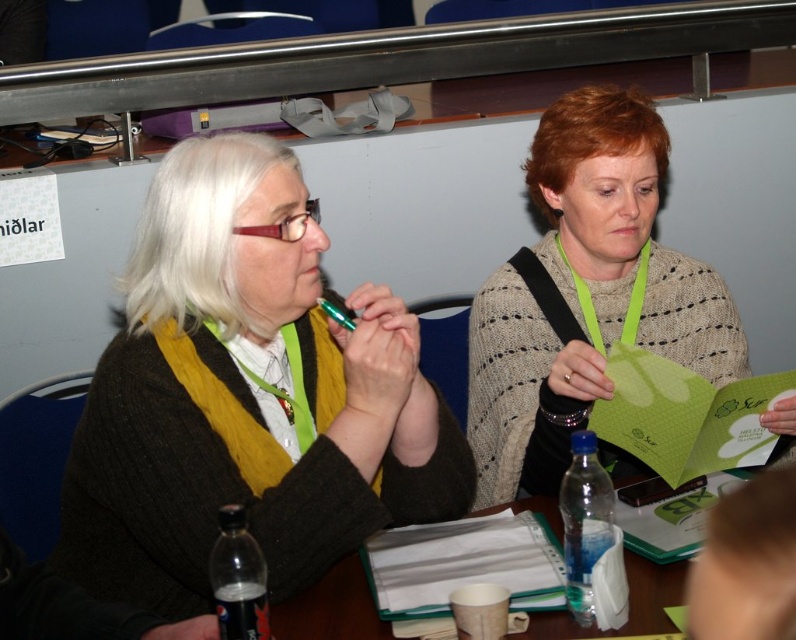
Question: Which point is closer to the camera?

Choices:
 (A) (630, 156)
 (B) (166, 246)

Answer: (B)

Question: Among these objects, which one is nearest to the camera?

Choices:
 (A) knitted beige sweater at center
 (B) matte black sweater at center

Answer: (B)

Question: Which of the following is the farthest from the observer?

Choices:
 (A) knitted beige sweater at center
 (B) matte black sweater at center

Answer: (A)

Question: Can you confirm if matte black sweater at center is positioned below knitted beige sweater at center?

Choices:
 (A) no
 (B) yes

Answer: (B)

Question: Is matte black sweater at center closer to camera compared to knitted beige sweater at center?

Choices:
 (A) no
 (B) yes

Answer: (B)

Question: Considering the relative positions of matte black sweater at center and knitted beige sweater at center in the image provided, where is matte black sweater at center located with respect to knitted beige sweater at center?

Choices:
 (A) below
 (B) above

Answer: (A)